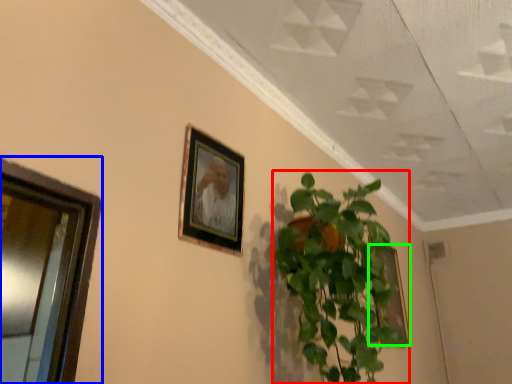
Question: Estimate the real-world distances between objects in this image. Which object is farther from houseplant (highlighted by a red box), window (highlighted by a blue box) or picture frame (highlighted by a green box)?

Choices:
 (A) window
 (B) picture frame

Answer: (B)